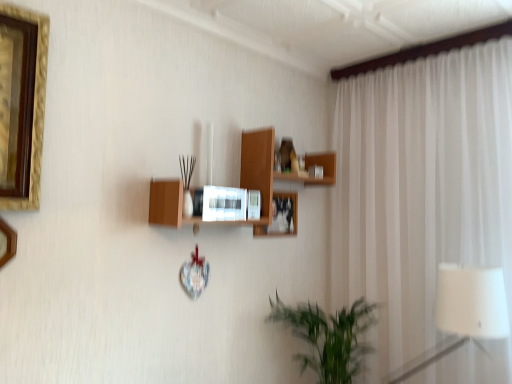
Question: Visually, is wooden microwave at center positioned to the left or to the right of gold-framed picture at left, which is the second picture frame in right-to-left order?

Choices:
 (A) right
 (B) left

Answer: (A)

Question: In the image, is wooden microwave at center positioned in front of or behind gold-framed picture at left, which ranks as the 2th picture frame in back-to-front order?

Choices:
 (A) front
 (B) behind

Answer: (B)

Question: Which of these objects is positioned closest to the white fabric lampshade at right?

Choices:
 (A) gold-framed picture at left, placed as the first picture frame when sorted from front to back
 (B) white sheer curtain at right
 (C) matte white picture frame at center, positioned as the 1th picture frame in back-to-front order
 (D) wooden microwave at center
 (E) green leafy plant at lower center

Answer: (B)

Question: Based on their relative distances, which object is nearer to the gold-framed picture at left, marked as the 1th picture frame in a left-to-right arrangement?

Choices:
 (A) white fabric lampshade at right
 (B) matte white picture frame at center, the 1th picture frame in the right-to-left sequence
 (C) wooden microwave at center
 (D) white sheer curtain at right
 (E) green leafy plant at lower center

Answer: (B)